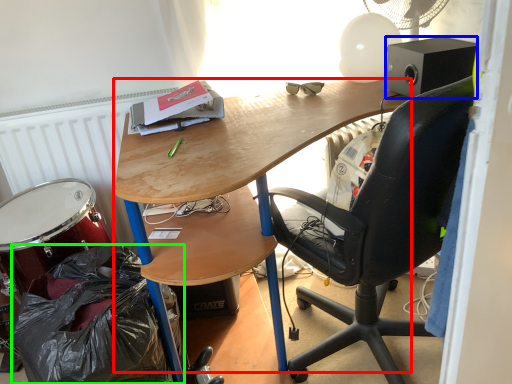
Question: Estimate the real-world distances between objects in this image. Which object is farther from desk (highlighted by a red box), loudspeaker (highlighted by a blue box) or garbage (highlighted by a green box)?

Choices:
 (A) loudspeaker
 (B) garbage

Answer: (B)